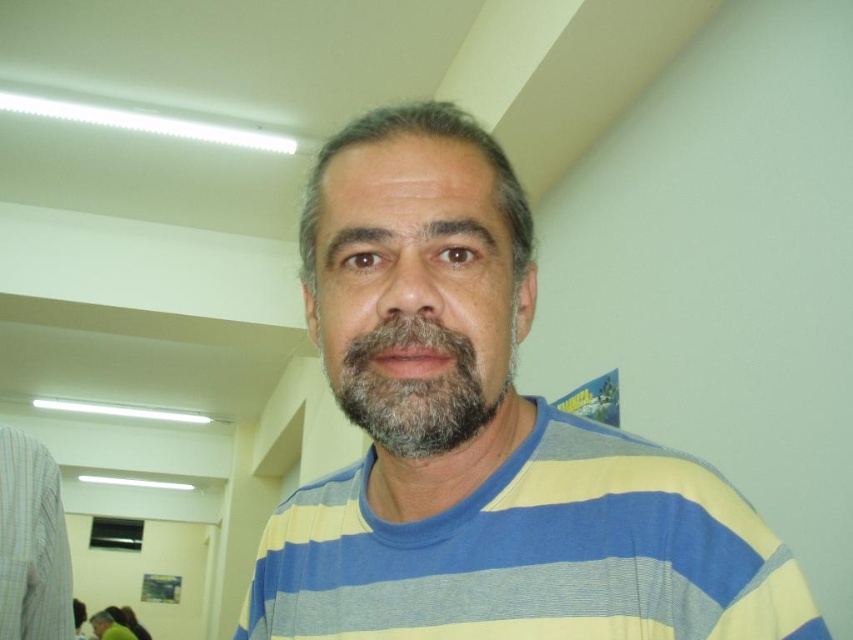
Question: Among these objects, which one is nearest to the camera?

Choices:
 (A) yellow-blue striped shirt at center
 (B) yellow-blue striped t-shirt at center

Answer: (A)

Question: Is yellow-blue striped shirt at center closer to camera compared to graywoollybeard at center?

Choices:
 (A) no
 (B) yes

Answer: (B)

Question: Which object appears closest to the camera in this image?

Choices:
 (A) yellow-blue striped t-shirt at center
 (B) yellow striped shirt at center
 (C) graywoollybeard at center
 (D) yellow-blue striped shirt at center

Answer: (D)

Question: Can you confirm if yellow-blue striped shirt at center is positioned above yellow striped shirt at center?

Choices:
 (A) yes
 (B) no

Answer: (A)

Question: Which of the following is the farthest from the observer?

Choices:
 (A) yellow-blue striped shirt at center
 (B) graywoollybeard at center

Answer: (B)

Question: Does yellow-blue striped shirt at center have a larger size compared to graywoollybeard at center?

Choices:
 (A) no
 (B) yes

Answer: (B)